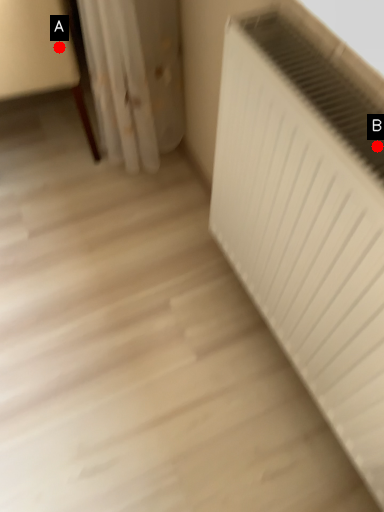
Question: Two points are circled on the image, labeled by A and B beside each circle. Which point is farther to the camera?

Choices:
 (A) A is further
 (B) B is further

Answer: (A)